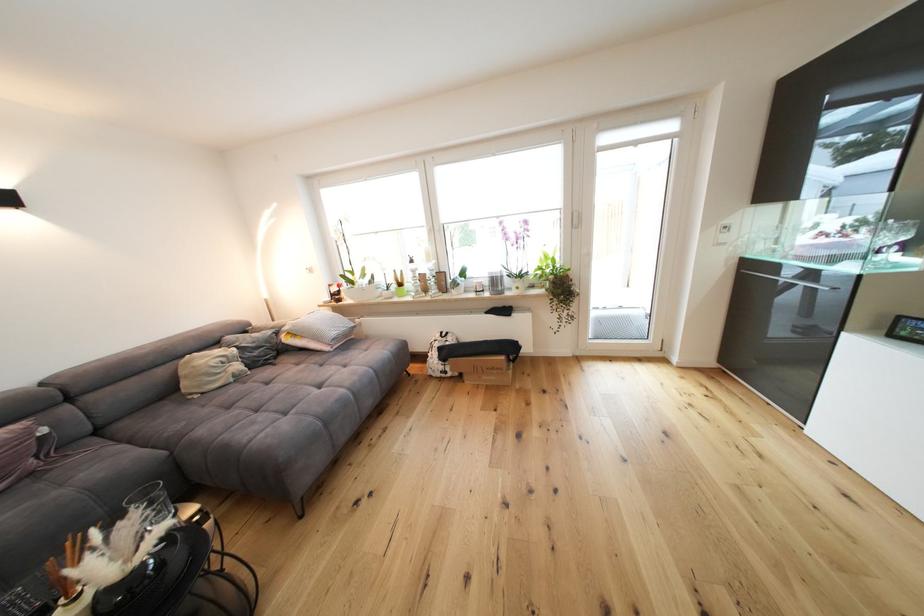
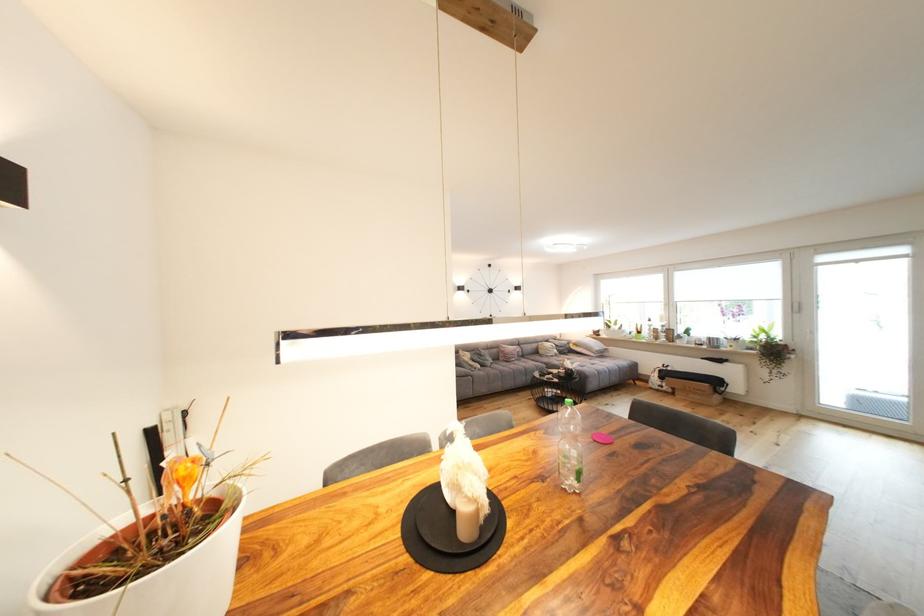
The point at (264, 331) is marked in the first image. Where is the corresponding point in the second image?

(566, 342)